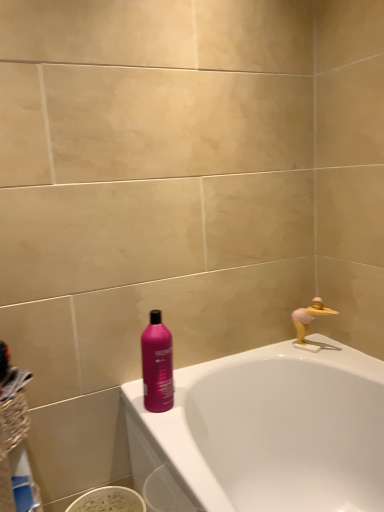
Question: Is the surface of matte pink bottle at center in direct contact with yellow rubber duck at upper right?

Choices:
 (A) yes
 (B) no

Answer: (B)

Question: Does matte pink bottle at center have a greater width compared to yellow rubber duck at upper right?

Choices:
 (A) no
 (B) yes

Answer: (B)

Question: Can you confirm if matte pink bottle at center is bigger than yellow rubber duck at upper right?

Choices:
 (A) no
 (B) yes

Answer: (B)

Question: Can you confirm if matte pink bottle at center is shorter than yellow rubber duck at upper right?

Choices:
 (A) no
 (B) yes

Answer: (A)

Question: Is matte pink bottle at center far away from yellow rubber duck at upper right?

Choices:
 (A) no
 (B) yes

Answer: (A)

Question: In terms of size, does yellow rubber duck at upper right appear bigger or smaller than matte pink bottle at center?

Choices:
 (A) small
 (B) big

Answer: (A)

Question: From the image's perspective, is yellow rubber duck at upper right above or below matte pink bottle at center?

Choices:
 (A) above
 (B) below

Answer: (A)

Question: Does point (314, 302) appear closer or farther from the camera than point (165, 394)?

Choices:
 (A) closer
 (B) farther

Answer: (B)

Question: Is yellow rubber duck at upper right inside the boundaries of matte pink bottle at center, or outside?

Choices:
 (A) outside
 (B) inside

Answer: (A)

Question: From their relative heights in the image, would you say white glossy bathtub at upper right is taller or shorter than yellow rubber duck at upper right?

Choices:
 (A) short
 (B) tall

Answer: (B)

Question: In terms of width, does white glossy bathtub at upper right look wider or thinner when compared to yellow rubber duck at upper right?

Choices:
 (A) thin
 (B) wide

Answer: (B)

Question: From the image's perspective, is white glossy bathtub at upper right located above or below yellow rubber duck at upper right?

Choices:
 (A) below
 (B) above

Answer: (A)

Question: From a real-world perspective, is white glossy bathtub at upper right above or below yellow rubber duck at upper right?

Choices:
 (A) below
 (B) above

Answer: (A)

Question: From a real-world perspective, is matte pink bottle at center physically located above or below white glossy bathtub at upper right?

Choices:
 (A) above
 (B) below

Answer: (A)

Question: Does point coord(144,391) appear closer or farther from the camera than point coord(175,473)?

Choices:
 (A) farther
 (B) closer

Answer: (A)